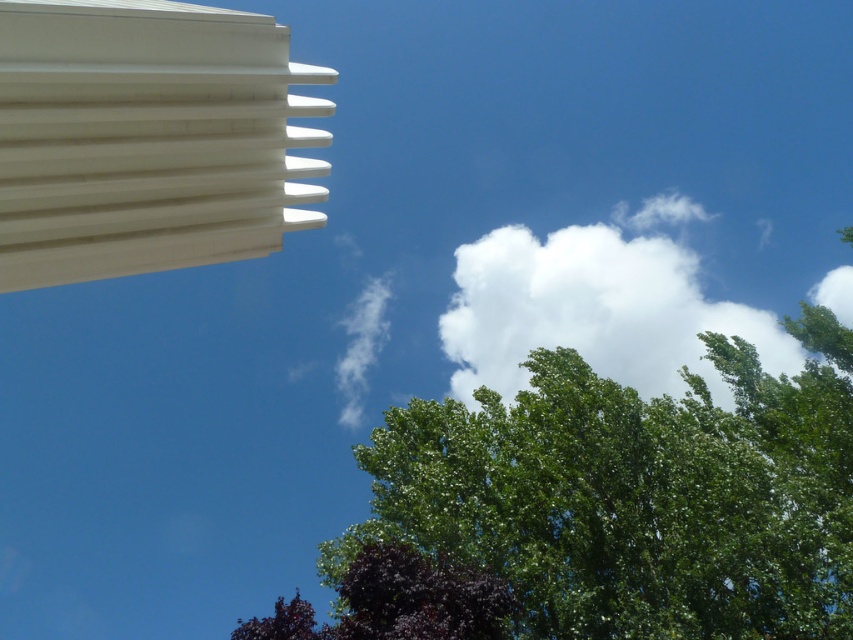
Question: Does white fluffy cloud at upper center lie in front of dark purple leafy tree at lower center?

Choices:
 (A) no
 (B) yes

Answer: (A)

Question: Which of the following is the farthest from the observer?

Choices:
 (A) (537, 346)
 (B) (469, 600)

Answer: (A)

Question: Is white fluffy cloud at upper center bigger than dark purple leafy tree at lower center?

Choices:
 (A) yes
 (B) no

Answer: (A)

Question: Does white fluffy cloud at upper center have a smaller size compared to dark purple leafy tree at lower center?

Choices:
 (A) no
 (B) yes

Answer: (A)

Question: Among these points, which one is farthest from the camera?

Choices:
 (A) (488, 634)
 (B) (439, 326)

Answer: (B)